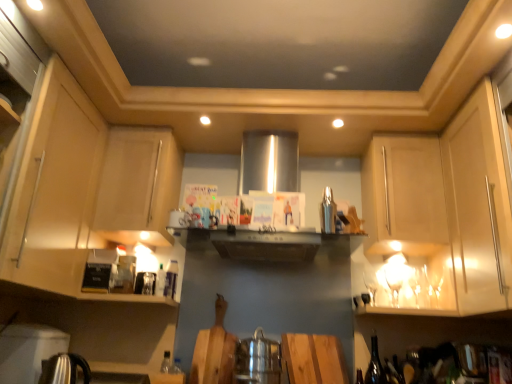
I want to click on free space to the left of translucent glass bottle at lower center, the 1th bottle in the left-to-right sequence, so click(x=131, y=303).